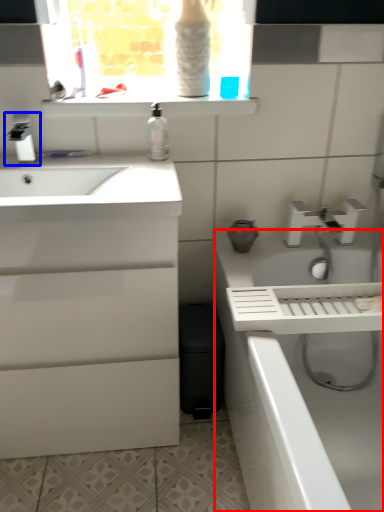
Question: Which object appears closest to the camera in this image, bath (highlighted by a red box) or tap (highlighted by a blue box)?

Choices:
 (A) bath
 (B) tap

Answer: (A)